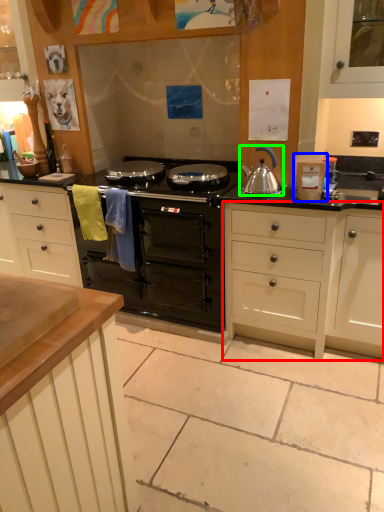
Question: Estimate the real-world distances between objects in this image. Which object is closer to cabinetry (highlighted by a red box), appliance (highlighted by a blue box) or kitchen appliance (highlighted by a green box)?

Choices:
 (A) appliance
 (B) kitchen appliance

Answer: (A)